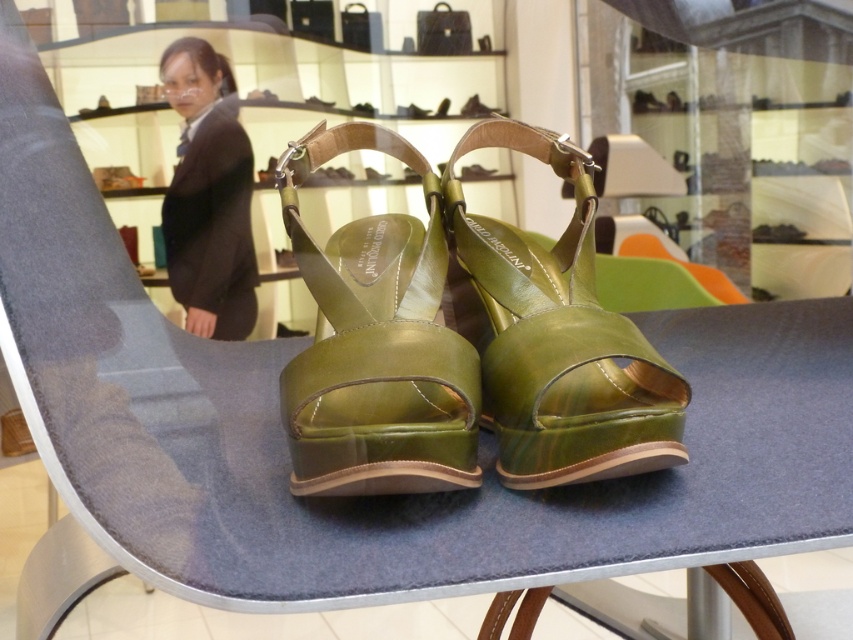
Question: Estimate the real-world distances between objects in this image. Which object is farther from the green shiny leather sandals at center?

Choices:
 (A) black fabric suit at upper left
 (B) green leather sandal at center

Answer: (A)

Question: Can you confirm if green leather sandal at center is wider than black fabric suit at upper left?

Choices:
 (A) yes
 (B) no

Answer: (A)

Question: Which of the following is the closest to the observer?

Choices:
 (A) (323, 388)
 (B) (563, 330)
 (C) (218, 132)

Answer: (A)

Question: Can you confirm if green shiny leather sandals at center is positioned below metallic green sandal at center?

Choices:
 (A) no
 (B) yes

Answer: (B)

Question: Does black fabric suit at upper left have a lesser width compared to metallic green sandal at center?

Choices:
 (A) yes
 (B) no

Answer: (B)

Question: Based on their relative distances, which object is farther from the green shiny leather sandals at center?

Choices:
 (A) black fabric suit at upper left
 (B) metallic green sandal at center
 (C) green leather sandal at center

Answer: (B)